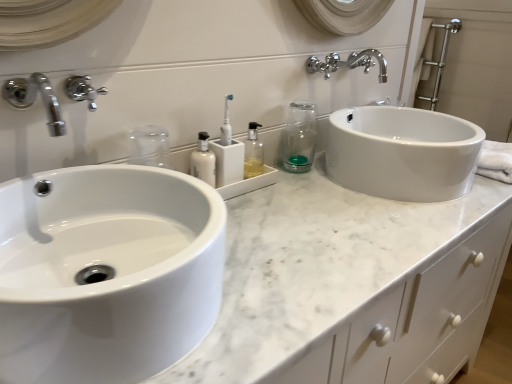
At what (x,y) coordinates should I click in order to perform the action: click on blank space situated above white marble countertop at center (from a real-world perspective). Please return your answer as a coordinate pair (x, y). The width and height of the screenshot is (512, 384). Looking at the image, I should click on (323, 217).